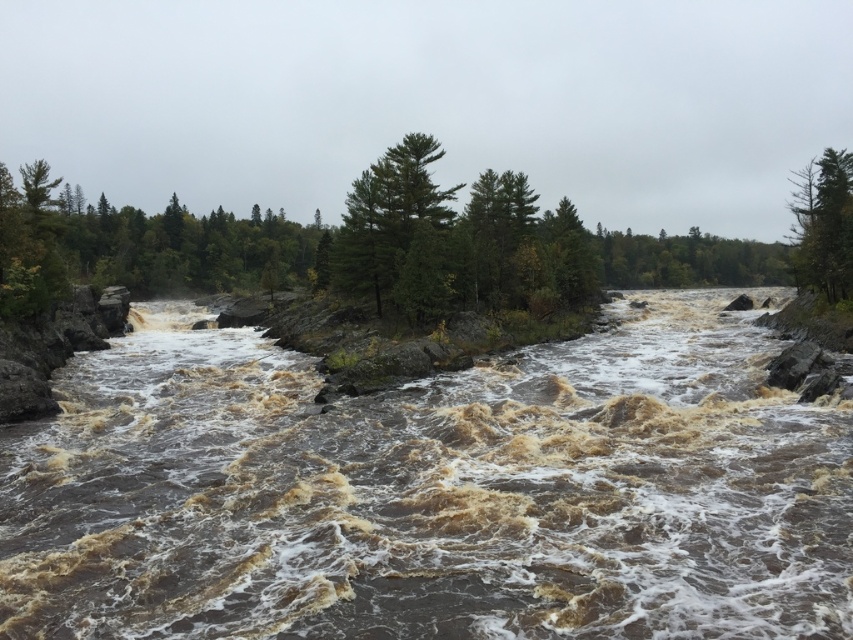
You are a hiker standing at the edge of the river. You notice brown muddy water at center and green leafy trees at center. Which object is closer to the ground?

The brown muddy water at center is located below green leafy trees at center, so it is closer to the ground.

You are standing at the point labeled point (x=387, y=216) in the river scene. What object are you currently standing on?

You are standing on the green matte tree at center.